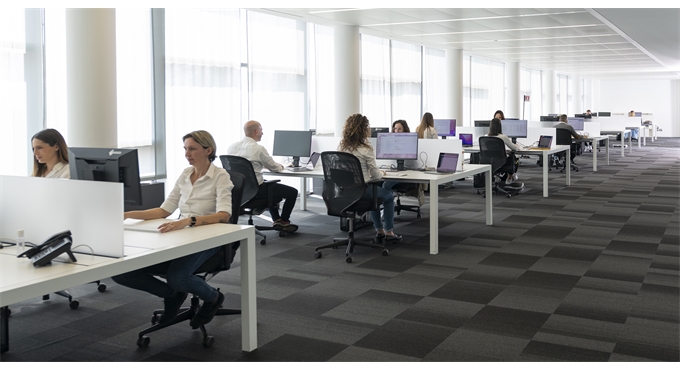
At what (x,y) coordinates should I click in order to perform the action: click on structural beams. Please return your answer as a coordinate pair (x, y). This screenshot has width=680, height=370. Looking at the image, I should click on (95, 98), (350, 89), (454, 96), (515, 82), (551, 86), (577, 92).